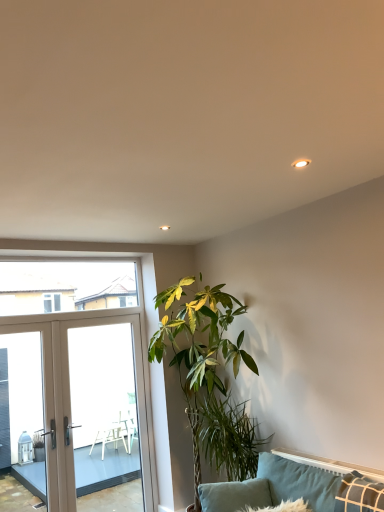
Question: From the image's perspective, relative to transparent glass window at upper left, is green leafy plant at center above or below?

Choices:
 (A) above
 (B) below

Answer: (B)

Question: From a real-world perspective, relative to transparent glass window at upper left, is green leafy plant at center vertically above or below?

Choices:
 (A) below
 (B) above

Answer: (A)

Question: Estimate the real-world distances between objects in this image. Which object is farther from the beige glass door at left?

Choices:
 (A) white glossy screen door at left
 (B) teal fabric couch at lower right
 (C) transparent glass window at upper left
 (D) velvet teal pillow at lower right
 (E) green leafy plant at lower center

Answer: (D)

Question: Considering the real-world distances, which object is farthest from the beige glass door at left?

Choices:
 (A) green leafy plant at lower center
 (B) green leafy plant at center
 (C) white glossy screen door at left
 (D) velvet teal pillow at lower right
 (E) teal fabric couch at lower right

Answer: (D)